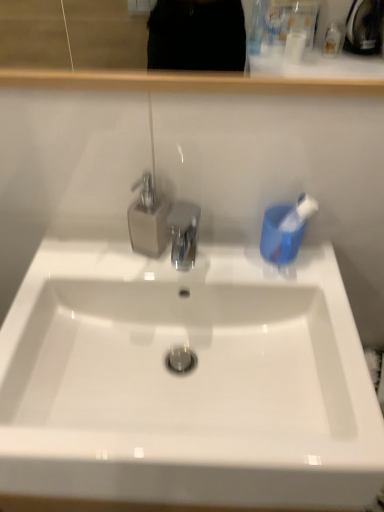
Question: Is white glossy sink at center shorter than blue plastic toothbrush at right?

Choices:
 (A) no
 (B) yes

Answer: (A)

Question: From the image's perspective, does white glossy sink at center appear higher than blue plastic toothbrush at right?

Choices:
 (A) no
 (B) yes

Answer: (A)

Question: Is white glossy sink at center at the left side of blue plastic toothbrush at right?

Choices:
 (A) no
 (B) yes

Answer: (B)

Question: Is the surface of white glossy sink at center in direct contact with blue plastic toothbrush at right?

Choices:
 (A) yes
 (B) no

Answer: (B)

Question: Is white glossy sink at center outside of blue plastic toothbrush at right?

Choices:
 (A) no
 (B) yes

Answer: (B)

Question: From the image's perspective, is white glossy sink at center above or below transparent plastic tap at center?

Choices:
 (A) above
 (B) below

Answer: (B)

Question: Is point (129, 332) positioned closer to the camera than point (145, 243)?

Choices:
 (A) farther
 (B) closer

Answer: (A)

Question: Is white glossy sink at center situated inside transparent plastic tap at center or outside?

Choices:
 (A) inside
 (B) outside

Answer: (B)

Question: Looking at their shapes, would you say white glossy sink at center is wider or thinner than transparent plastic tap at center?

Choices:
 (A) thin
 (B) wide

Answer: (B)

Question: Is transparent plastic tap at center wider or thinner than blue plastic toothbrush at right?

Choices:
 (A) wide
 (B) thin

Answer: (A)

Question: Which is correct: transparent plastic tap at center is inside blue plastic toothbrush at right, or outside of it?

Choices:
 (A) inside
 (B) outside

Answer: (B)

Question: Considering the positions of transparent plastic tap at center and blue plastic toothbrush at right in the image, is transparent plastic tap at center bigger or smaller than blue plastic toothbrush at right?

Choices:
 (A) big
 (B) small

Answer: (A)

Question: From a real-world perspective, is transparent plastic tap at center physically located above or below blue plastic toothbrush at right?

Choices:
 (A) below
 (B) above

Answer: (B)

Question: Considering the positions of white glossy sink at center and blue plastic toothbrush at right in the image, is white glossy sink at center bigger or smaller than blue plastic toothbrush at right?

Choices:
 (A) small
 (B) big

Answer: (B)

Question: Is white glossy sink at center in front of or behind blue plastic toothbrush at right in the image?

Choices:
 (A) front
 (B) behind

Answer: (A)